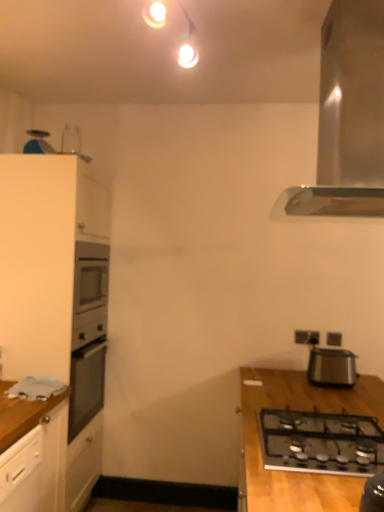
Question: From the image's perspective, is white matte cabinet at left located above or below black plastic toaster at right?

Choices:
 (A) above
 (B) below

Answer: (A)

Question: Is white matte cabinet at left to the left or to the right of black plastic toaster at right in the image?

Choices:
 (A) left
 (B) right

Answer: (A)

Question: Which of these objects is positioned farthest from the satin silver range hood at upper right?

Choices:
 (A) black plastic electric outlet at upper right, which is counted as the 2th electric outlet, starting from the left
 (B) white matte cabinet at left
 (C) white plastic electric outlet at upper right, marked as the 2th electric outlet in a right-to-left arrangement
 (D) black plastic toaster at right
 (E) wooden table at lower right

Answer: (B)

Question: Which object is the farthest from the white plastic electric outlet at upper right, placed as the 1th electric outlet when sorted from left to right?

Choices:
 (A) wooden table at lower right
 (B) black glass gas stove at lower right
 (C) satin silver range hood at upper right
 (D) white matte cabinet at left
 (E) black plastic toaster at right

Answer: (D)